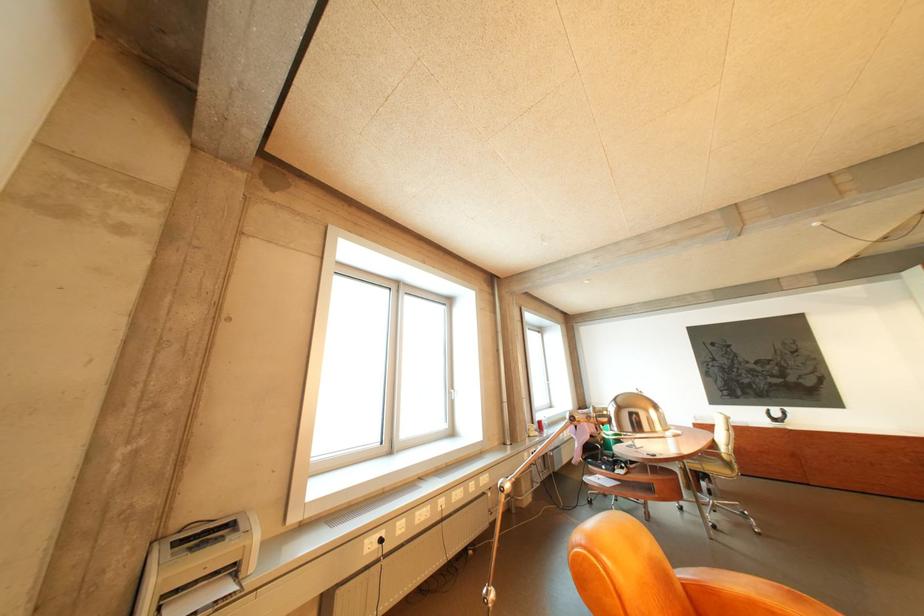
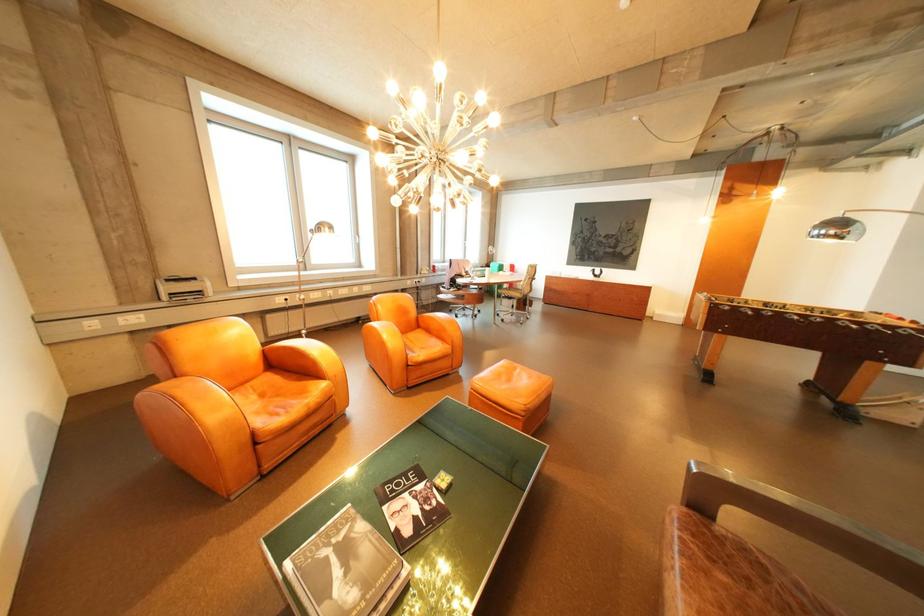
In the second image, find the point that corresponds to (246,525) in the first image.

(208, 280)